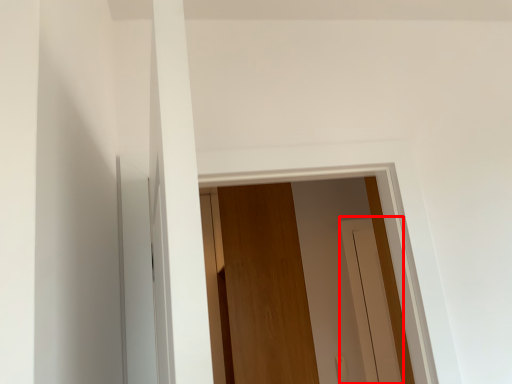
Question: From the image's perspective, where is screen door (annotated by the red box) located relative to door?

Choices:
 (A) above
 (B) below

Answer: (B)